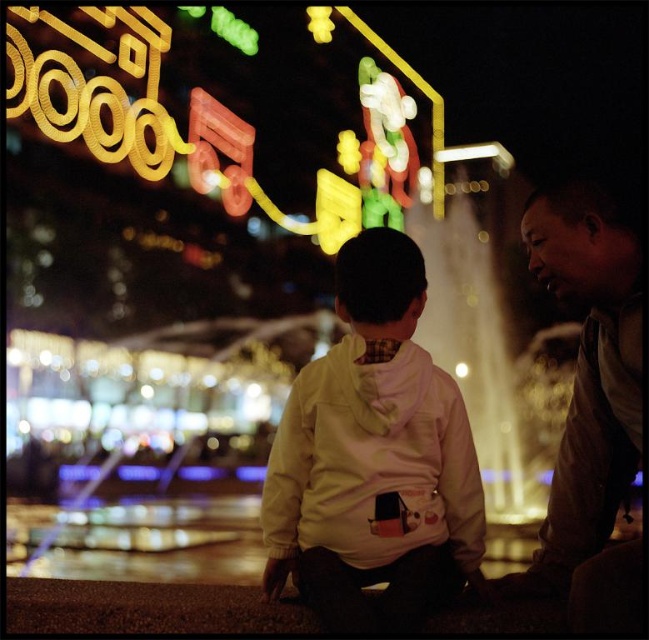
You are a photographer trying to capture a candid shot of both the white fleece jacket at center and the brown leather jacket at right. Since you want to ensure both are visible in the frame, which jacket should you focus on first to make sure it stays in the shot?

The brown leather jacket at right is behind the white fleece jacket at center, so you should focus on the white fleece jacket at center first to ensure it doesn not block the brown leather jacket at right from view.

You are a photographer trying to capture a photo of the white fleece jacket at center and the brown leather jacket at right. The neon lights in the background are too bright. Which jacket should you adjust your camera focus to first to ensure both are in the frame?

The white fleece jacket at center is to the left of brown leather jacket at right. To ensure both are in the frame, focus on the white fleece jacket at center first since it is closer to the left edge, allowing you to adjust the frame to include both jackets while managing the neon lights.

You are a fashion designer analyzing the clothing in the image. Which jacket, the white fleece jacket at center or the brown leather jacket at right, is shorter in height?

The white fleece jacket at center has a lesser height compared to the brown leather jacket at right, so the white fleece jacket at center is shorter in height.